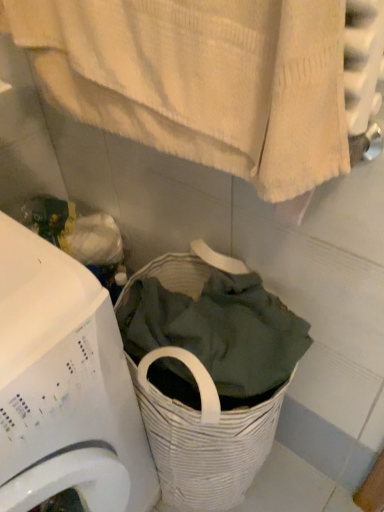
Question: Is white plastic washing machine at lower left positioned with its back to white textured towel at upper center?

Choices:
 (A) yes
 (B) no

Answer: (B)

Question: Is white plastic washing machine at lower left located outside white textured towel at upper center?

Choices:
 (A) yes
 (B) no

Answer: (A)

Question: From a real-world perspective, is white plastic washing machine at lower left physically above white textured towel at upper center?

Choices:
 (A) no
 (B) yes

Answer: (A)

Question: Can you confirm if white plastic washing machine at lower left is bigger than white textured towel at upper center?

Choices:
 (A) no
 (B) yes

Answer: (B)

Question: Considering the relative sizes of white plastic washing machine at lower left and white textured towel at upper center in the image provided, is white plastic washing machine at lower left thinner than white textured towel at upper center?

Choices:
 (A) yes
 (B) no

Answer: (B)

Question: Would you say white plastic washing machine at lower left is a long distance from white textured towel at upper center?

Choices:
 (A) no
 (B) yes

Answer: (A)

Question: Considering the relative positions of white textured towel at upper center and white plastic washing machine at lower left in the image provided, is white textured towel at upper center to the left of white plastic washing machine at lower left from the viewer's perspective?

Choices:
 (A) no
 (B) yes

Answer: (A)

Question: Considering the relative sizes of white textured towel at upper center and white plastic washing machine at lower left in the image provided, is white textured towel at upper center wider than white plastic washing machine at lower left?

Choices:
 (A) yes
 (B) no

Answer: (B)

Question: Does white textured towel at upper center come behind white plastic washing machine at lower left?

Choices:
 (A) no
 (B) yes

Answer: (A)

Question: From a real-world perspective, is white textured towel at upper center located higher than white plastic washing machine at lower left?

Choices:
 (A) no
 (B) yes

Answer: (B)

Question: Is white plastic washing machine at lower left located within white textured towel at upper center?

Choices:
 (A) yes
 (B) no

Answer: (B)

Question: Considering the relative sizes of white textured towel at upper center and white plastic washing machine at lower left in the image provided, is white textured towel at upper center taller than white plastic washing machine at lower left?

Choices:
 (A) no
 (B) yes

Answer: (A)

Question: From the image's perspective, is white plastic washing machine at lower left above or below white textured towel at upper center?

Choices:
 (A) below
 (B) above

Answer: (A)